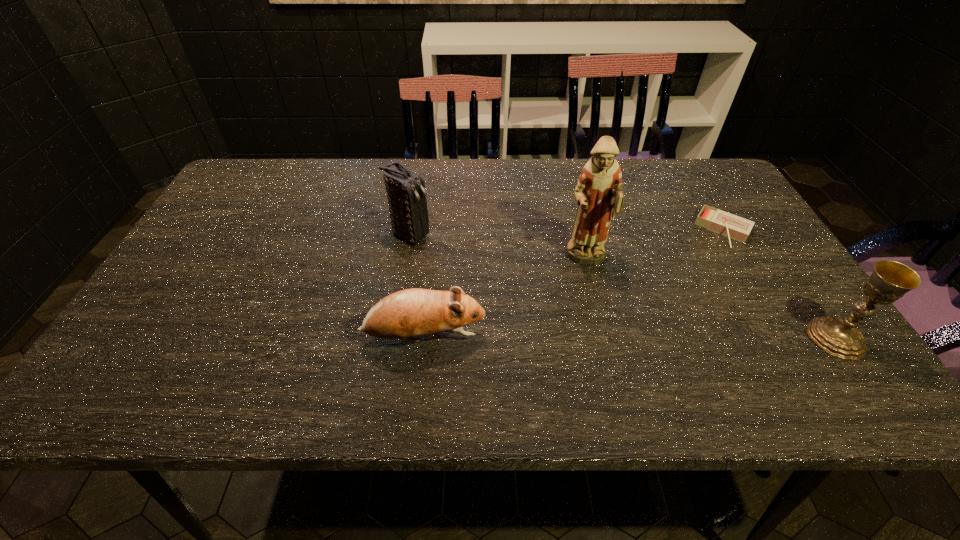
Identify the location of empty space that is in between the clutch bag and the third object from left to right. This screenshot has width=960, height=540. (498, 248).

What are the coordinates of `empty location between the chalice and the clutch bag` in the screenshot? It's located at click(623, 287).

Identify the location of vacant area that lies between the shortest object and the chalice. The width and height of the screenshot is (960, 540). (780, 284).

This screenshot has width=960, height=540. I want to click on unoccupied position between the clutch bag and the shortest object, so point(566,233).

Find the location of a particular element. Image resolution: width=960 pixels, height=540 pixels. unoccupied position between the chalice and the clutch bag is located at coordinates (623, 287).

This screenshot has width=960, height=540. I want to click on empty location between the chalice and the matchbox, so click(x=780, y=284).

Image resolution: width=960 pixels, height=540 pixels. What are the coordinates of `empty space that is in between the clutch bag and the shortest object` in the screenshot? It's located at (566, 233).

Locate which object ranks second in proximity to the matchbox. Please provide its 2D coordinates. Your answer should be formatted as a tuple, i.e. [(x, y)], where the tuple contains the x and y coordinates of a point satisfying the conditions above.

[(599, 193)]

At what (x,y) coordinates should I click in order to perform the action: click on object that can be found as the fourth closest to the matchbox. Please return your answer as a coordinate pair (x, y). The height and width of the screenshot is (540, 960). Looking at the image, I should click on (406, 194).